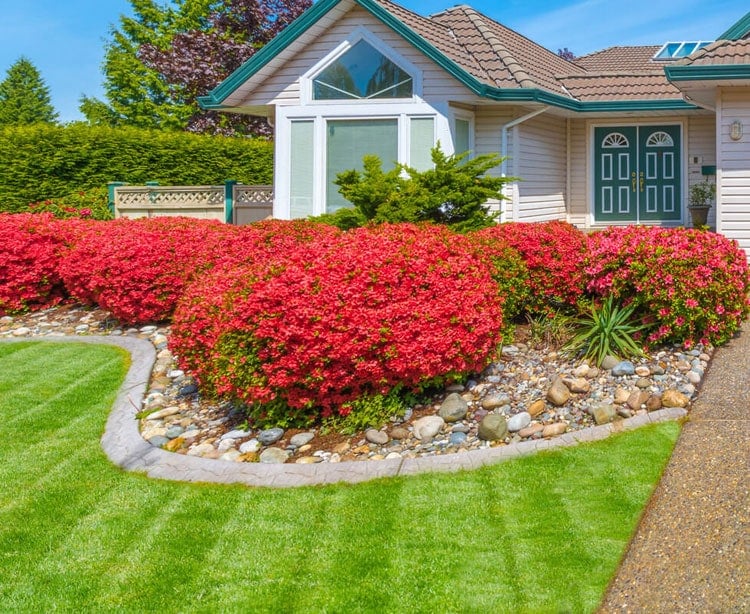
You are a GUI agent. You are given a task and a screenshot of the screen. Output one action in this format:
    pyautogui.click(x=<x>, y=<y>)
    Task: Click on the window
    The height and width of the screenshot is (614, 750).
    Given the screenshot: What is the action you would take?
    pyautogui.click(x=340, y=75), pyautogui.click(x=358, y=150), pyautogui.click(x=300, y=153), pyautogui.click(x=416, y=145), pyautogui.click(x=458, y=133)